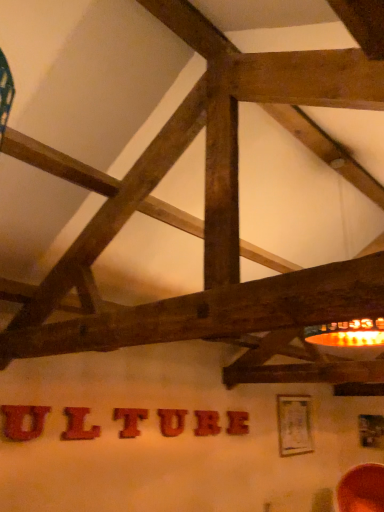
Question: From a real-world perspective, is wooden letter at center, the 3th letter in the right-to-left sequence, physically above wooden letter at center, which is the sixth letter in front-to-back order?

Choices:
 (A) no
 (B) yes

Answer: (B)

Question: Is wooden letter at center, placed as the 4th letter when sorted from left to right, at the left side of wooden letter at center, which is the sixth letter in left-to-right order?

Choices:
 (A) no
 (B) yes

Answer: (B)

Question: From the image's perspective, is wooden letter at center, the third letter when ordered from back to front, under wooden letter at center, which ranks as the 1th letter in right-to-left order?

Choices:
 (A) no
 (B) yes

Answer: (A)

Question: Considering the relative sizes of wooden letter at center, positioned as the fourth letter in front-to-back order, and wooden letter at center, which is the sixth letter in front-to-back order, in the image provided, is wooden letter at center, positioned as the fourth letter in front-to-back order, shorter than wooden letter at center, which is the sixth letter in front-to-back order,?

Choices:
 (A) no
 (B) yes

Answer: (A)

Question: Does wooden letter at center, the 3th letter in the right-to-left sequence, have a greater height compared to wooden letter at center, which is the sixth letter in left-to-right order?

Choices:
 (A) no
 (B) yes

Answer: (B)

Question: Considering their positions, is brushed wood letter at center, which is the 6th letter from back to front, located in front of or behind wooden letter at center, which ranks as the 1th letter in right-to-left order?

Choices:
 (A) front
 (B) behind

Answer: (A)

Question: Is brushed wood letter at center, which is counted as the 6th letter, starting from the right, situated inside wooden letter at center, which is the sixth letter in front-to-back order, or outside?

Choices:
 (A) inside
 (B) outside

Answer: (B)

Question: From their relative heights in the image, would you say brushed wood letter at center, marked as the 1th letter in a front-to-back arrangement, is taller or shorter than wooden letter at center, the 1th letter in the back-to-front sequence?

Choices:
 (A) short
 (B) tall

Answer: (A)

Question: In terms of width, does brushed wood letter at center, which is counted as the 6th letter, starting from the right, look wider or thinner when compared to wooden letter at center, which ranks as the 1th letter in right-to-left order?

Choices:
 (A) wide
 (B) thin

Answer: (B)

Question: From their relative heights in the image, would you say wooden letter at center, acting as the fifth letter starting from the front, is taller or shorter than wooden letter at center, which is the sixth letter in left-to-right order?

Choices:
 (A) tall
 (B) short

Answer: (A)

Question: Considering the positions of point (195, 413) and point (243, 428), is point (195, 413) closer or farther from the camera than point (243, 428)?

Choices:
 (A) closer
 (B) farther

Answer: (A)

Question: In the image, is wooden letter at center, arranged as the second letter when viewed from the back, on the left side or the right side of wooden letter at center, the 1th letter in the back-to-front sequence?

Choices:
 (A) left
 (B) right

Answer: (A)

Question: Is wooden letter at center, arranged as the second letter when viewed from the back, situated inside wooden letter at center, which is the sixth letter in left-to-right order, or outside?

Choices:
 (A) outside
 (B) inside

Answer: (A)

Question: Looking at their shapes, would you say matte red letter at center, the 5th letter in the back-to-front sequence, is wider or thinner than wooden letter t at center, which ranks as the fourth letter in right-to-left order?

Choices:
 (A) wide
 (B) thin

Answer: (B)

Question: Which is correct: matte red letter at center, the 2th letter from the front, is inside wooden letter t at center, marked as the 4th letter in a back-to-front arrangement, or outside of it?

Choices:
 (A) outside
 (B) inside

Answer: (A)